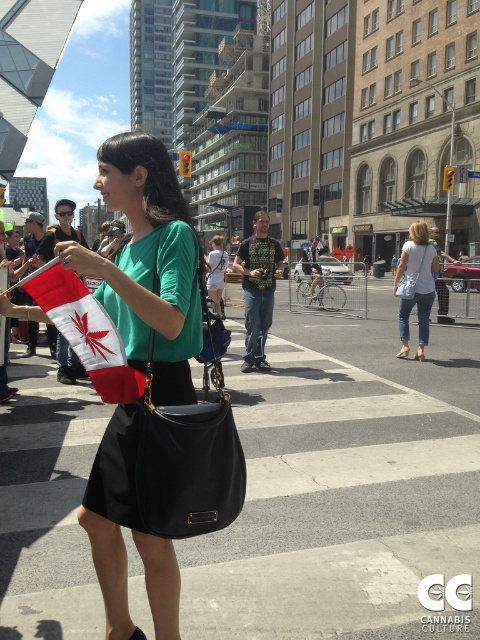
Which of these two, matte black bag at center or black leather handbag at center, stands taller?

With more height is black leather handbag at center.

Is point (158, 625) positioned after point (146, 456)?

Yes, it is behind point (146, 456).

Is point (84, 252) closer to viewer compared to point (181, 404)?

Yes, it is in front of point (181, 404).

The image size is (480, 640). I want to click on matte black bag at center, so click(x=147, y=262).

Can you confirm if matte black bag at center is bigger than red fabric flag at center?

Yes.

Measure the distance between matte black bag at center and red fabric flag at center.

matte black bag at center and red fabric flag at center are 8.06 inches apart.

What do you see at coordinates (147, 262) in the screenshot? I see `matte black bag at center` at bounding box center [147, 262].

The height and width of the screenshot is (640, 480). Identify the location of matte black bag at center. (147, 262).

Does matte black bag at center appear on the left side of white matte shorts at center?

No, matte black bag at center is not to the left of white matte shorts at center.

Between point (115, 476) and point (211, 266), which one is positioned behind?

Point (211, 266)

Between point (151, 218) and point (225, 264), which one is positioned behind?

The point (225, 264) is more distant.

Identify the location of matte black bag at center. (147, 262).